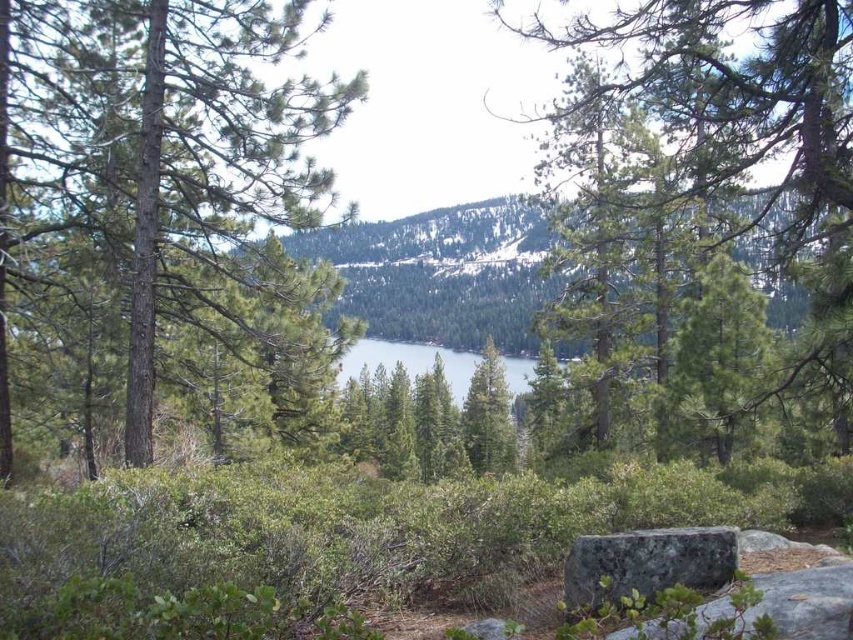
Does point (260, 3) lie in front of point (691, 531)?

No, it is behind (691, 531).

Who is higher up, green rough bark tree at center or gray/rough rock at center?

green rough bark tree at center is above.

Locate an element on the screen. This screenshot has width=853, height=640. green rough bark tree at center is located at coordinates (155, 150).

This screenshot has height=640, width=853. What are the coordinates of `green rough bark tree at center` in the screenshot? It's located at (155, 150).

Can you confirm if gray/rough rock at center is taller than clear blue water at center?

In fact, gray/rough rock at center may be shorter than clear blue water at center.

What do you see at coordinates (646, 563) in the screenshot? I see `gray/rough rock at center` at bounding box center [646, 563].

Does point (590, 554) lie behind point (473, 360)?

No, it is in front of (473, 360).

This screenshot has width=853, height=640. In order to click on gray/rough rock at center in this screenshot , I will do `click(646, 563)`.

Is gray/rough rock at center to the right of green textured pine tree at center from the viewer's perspective?

In fact, gray/rough rock at center is to the left of green textured pine tree at center.

Does point (664, 531) come behind point (512, 460)?

No, it is not.

Where is `gray/rough rock at center`? This screenshot has height=640, width=853. gray/rough rock at center is located at coordinates (646, 563).